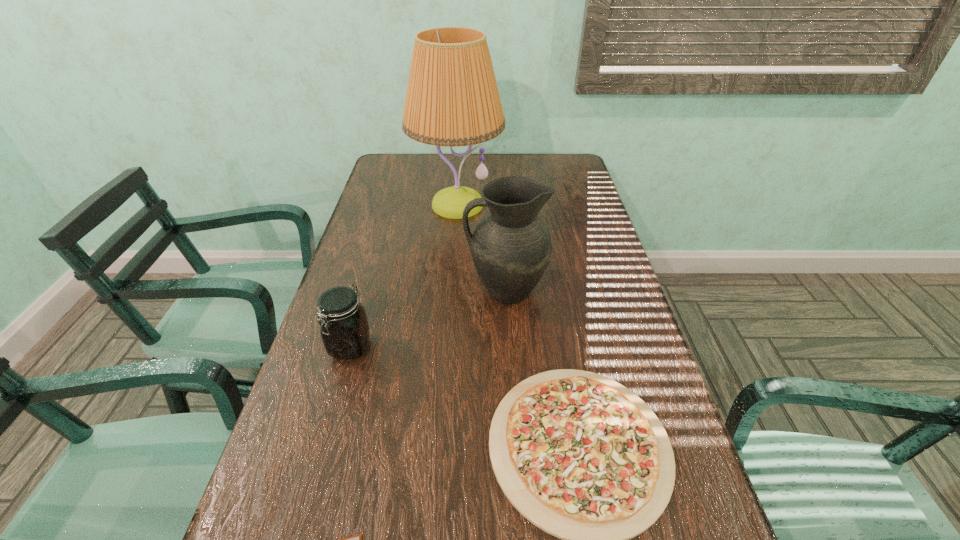
I want to click on the tallest object, so click(x=452, y=99).

Locate an element on the screen. The height and width of the screenshot is (540, 960). lamp is located at coordinates (452, 99).

Image resolution: width=960 pixels, height=540 pixels. Identify the location of pitcher. (511, 247).

This screenshot has width=960, height=540. Identify the location of the fourth nearest object. (511, 247).

You are a GUI agent. You are given a task and a screenshot of the screen. Output one action in this format:
    pyautogui.click(x=<x>, y=<y>)
    Task: Click on the third shortest object
    This screenshot has height=540, width=960.
    Given the screenshot: What is the action you would take?
    pyautogui.click(x=344, y=328)

This screenshot has width=960, height=540. Find the location of `the third nearest object`. the third nearest object is located at coordinates (344, 328).

What are the coordinates of `vacant space located on the side of the tallest object near the pull switch` in the screenshot? It's located at (450, 298).

In order to click on vacant space located on the side of the second farthest object with the handle in this screenshot , I will do `click(398, 291)`.

Identify the location of vacant space located 0.240m on the side of the second farthest object with the handle. This screenshot has width=960, height=540. (376, 291).

Locate an element on the screen. The image size is (960, 540). free space located 0.230m on the side of the second farthest object with the handle is located at coordinates (380, 291).